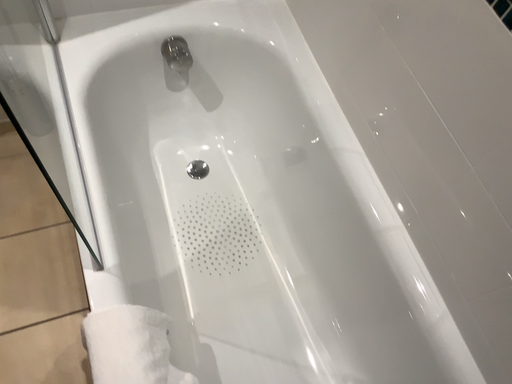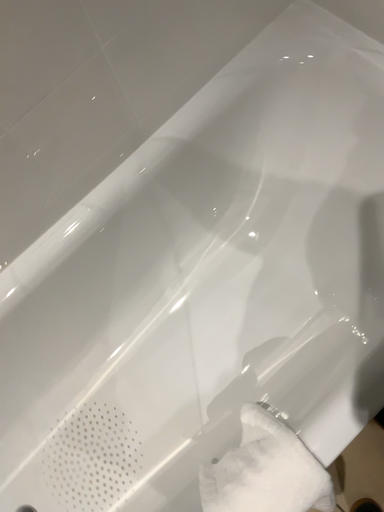
Question: How did the camera likely rotate when shooting the video?

Choices:
 (A) rotated downward
 (B) rotated upward

Answer: (B)